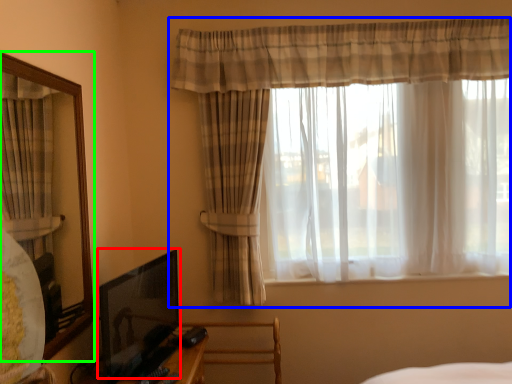
Question: Which object is the farthest from picture frame (highlighted by a red box)? Choose among these: curtain (highlighted by a blue box) or mirror (highlighted by a green box).

Choices:
 (A) curtain
 (B) mirror

Answer: (A)